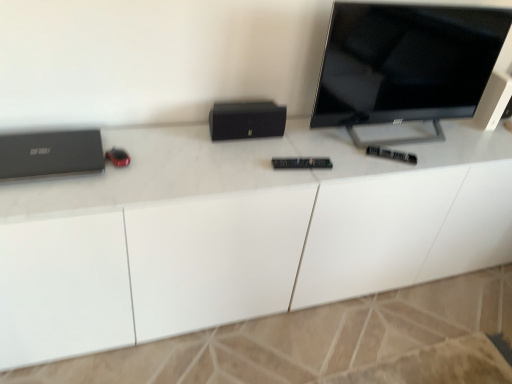
This screenshot has width=512, height=384. In order to click on free location in front of black matte speaker at upper right in this screenshot , I will do `click(486, 144)`.